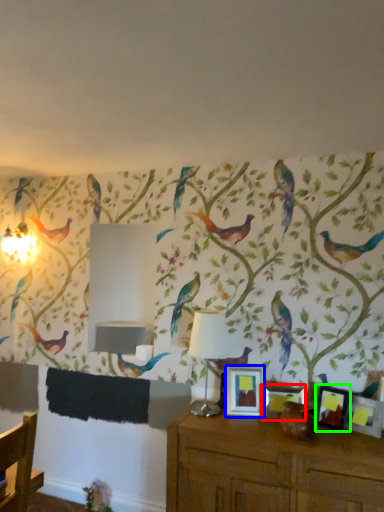
Question: Which is farther away from picture frame (highlighted by a red box)? picture frame (highlighted by a blue box) or picture frame (highlighted by a green box)?

Choices:
 (A) picture frame
 (B) picture frame

Answer: (B)